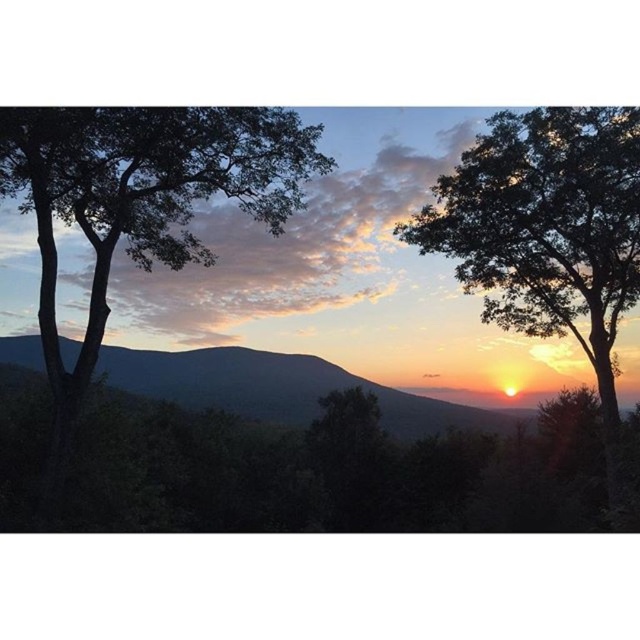
Is point (474, 246) in front of point (228, 397)?

Yes, it is in front of point (228, 397).

Who is lower down, green leafy tree at right or silvery metallic mountain at center?

Positioned lower is silvery metallic mountain at center.

Does point (612, 244) come closer to viewer compared to point (68, 365)?

Yes, point (612, 244) is closer to viewer.

You are a GUI agent. You are given a task and a screenshot of the screen. Output one action in this format:
    pyautogui.click(x=<x>, y=<y>)
    Task: Click on the green leafy tree at right
    The image size is (640, 640).
    Given the screenshot: What is the action you would take?
    pyautogui.click(x=545, y=227)

This screenshot has width=640, height=640. Describe the element at coordinates (138, 205) in the screenshot. I see `green leafy tree at left` at that location.

Does green leafy tree at left appear on the right side of silvery metallic mountain at center?

No, green leafy tree at left is not to the right of silvery metallic mountain at center.

What do you see at coordinates (138, 205) in the screenshot? I see `green leafy tree at left` at bounding box center [138, 205].

The image size is (640, 640). In order to click on green leafy tree at left in this screenshot , I will do `click(138, 205)`.

Is green leafy tree at left to the right of green leafy tree at right from the viewer's perspective?

No, green leafy tree at left is not to the right of green leafy tree at right.

Which of these two, green leafy tree at left or green leafy tree at right, stands taller?

With more height is green leafy tree at left.

Between point (10, 180) and point (484, 289), which one is positioned in front?

Positioned in front is point (10, 180).

Locate an element on the screen. green leafy tree at left is located at coordinates (138, 205).